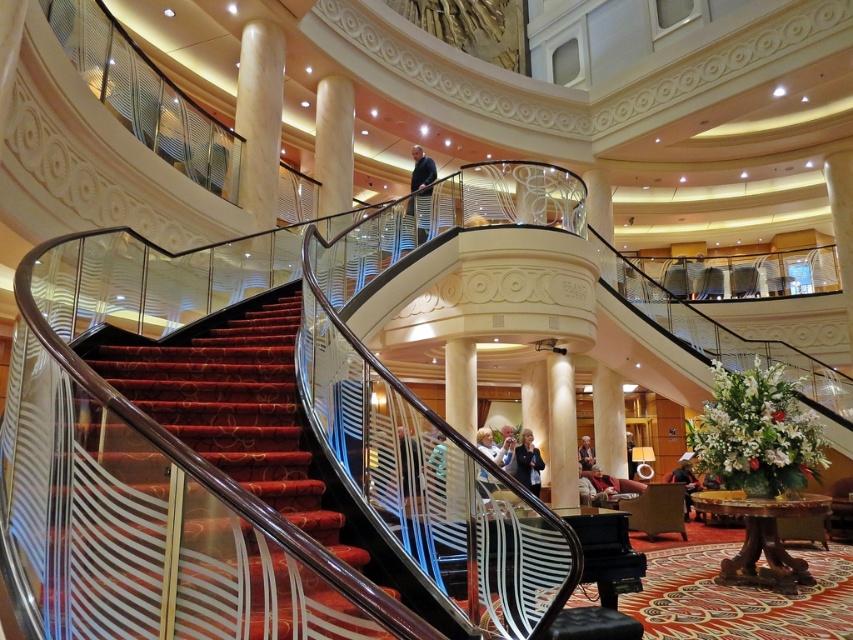
Which is above, velvet red stairs at center or creamy marble column at upper center?

creamy marble column at upper center

Based on the photo, can you confirm if velvet red stairs at center is taller than creamy marble column at upper center?

No, velvet red stairs at center is not taller than creamy marble column at upper center.

Where is `velvet red stairs at center`? velvet red stairs at center is located at coordinates (233, 403).

This screenshot has width=853, height=640. In order to click on velvet red stairs at center in this screenshot , I will do `click(233, 403)`.